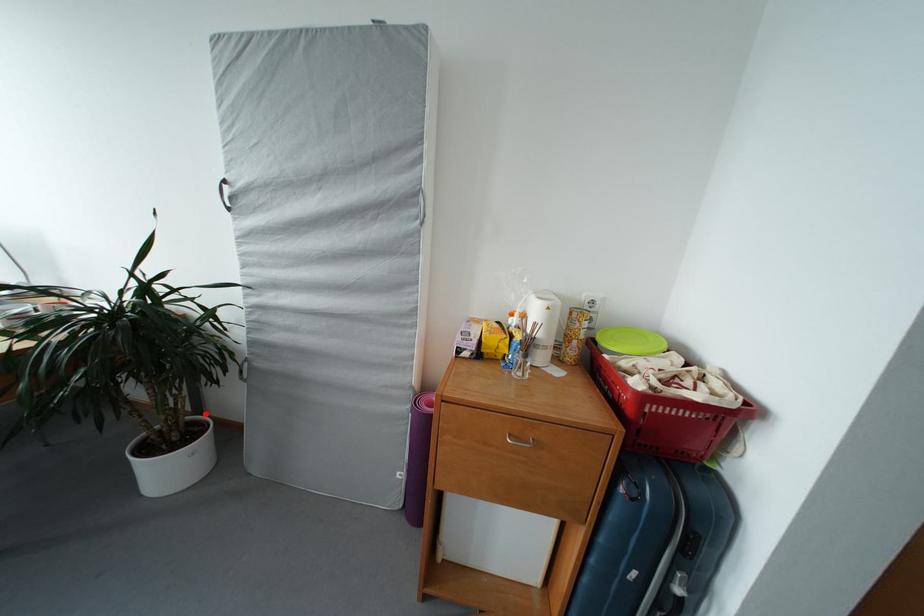
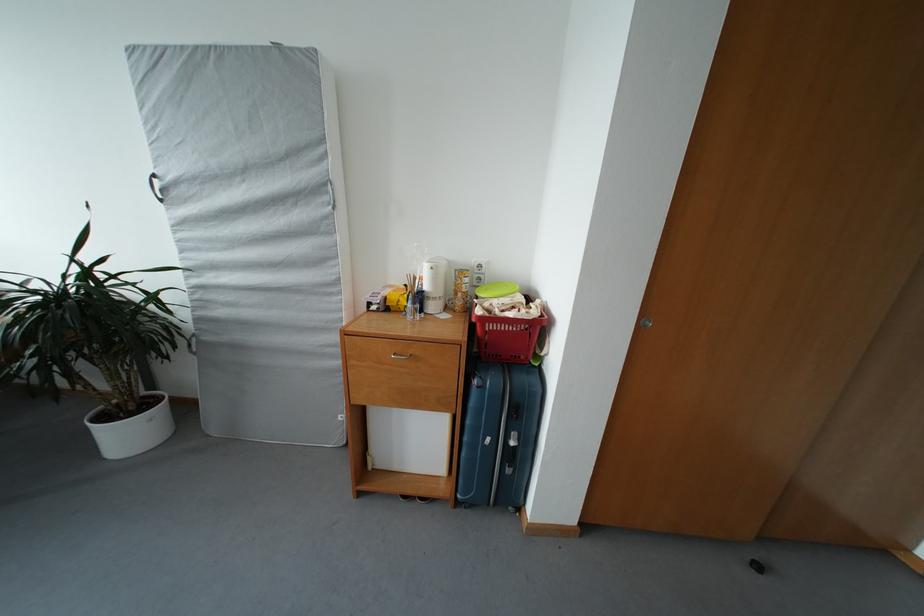
The point at the highlighted location is marked in the first image. Where is the corresponding point in the second image?

(159, 391)